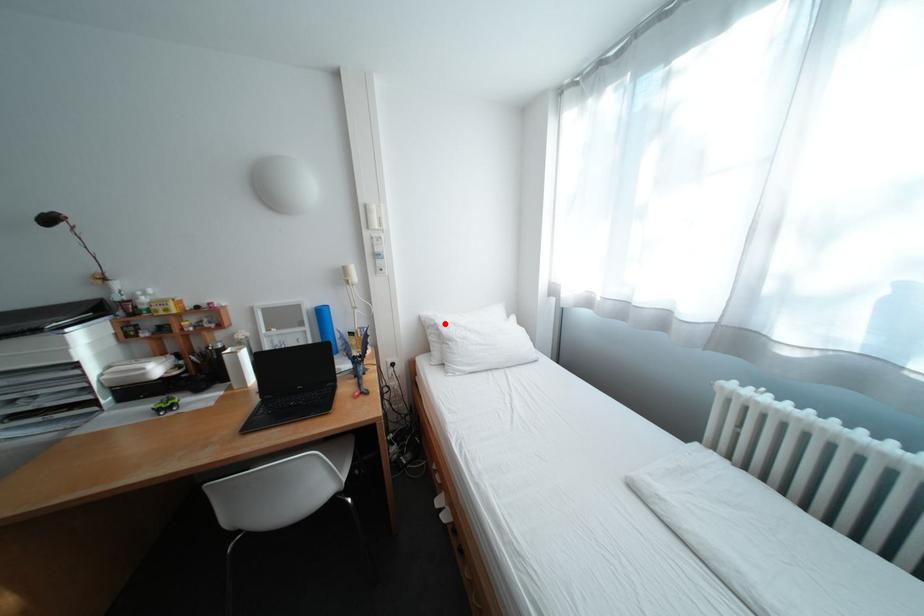
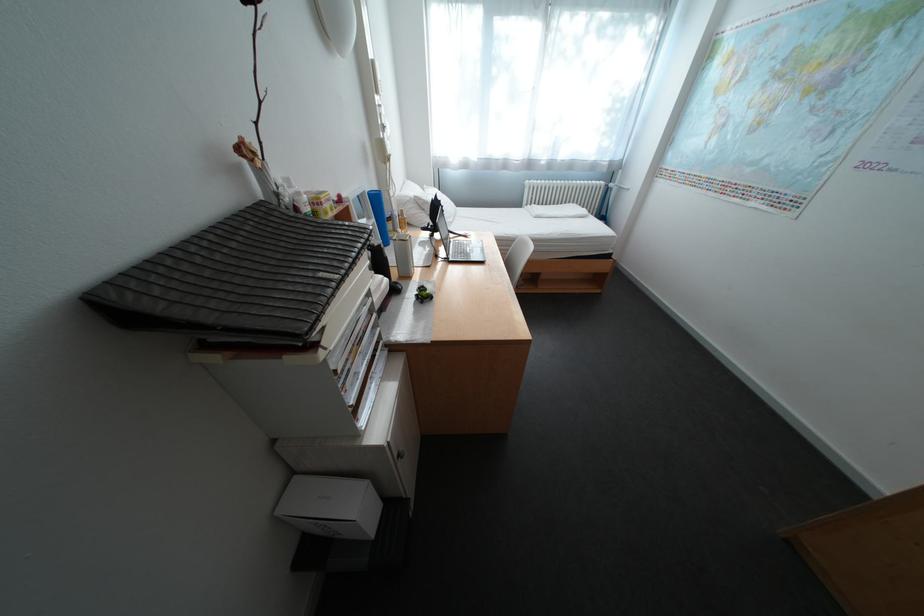
In the second image, find the point that corresponds to the highlighted location in the first image.

(420, 200)